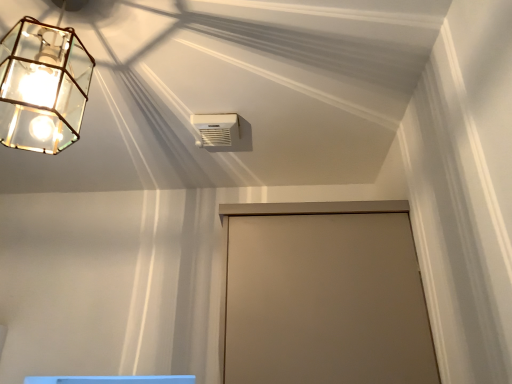
Question: Is white plastic air conditioning unit at upper center bigger or smaller than clear glass lantern at upper left?

Choices:
 (A) small
 (B) big

Answer: (A)

Question: Would you say white plastic air conditioning unit at upper center is to the left or to the right of clear glass lantern at upper left in the picture?

Choices:
 (A) right
 (B) left

Answer: (A)

Question: Considering the real-world distances, which object is closest to the clear glass lantern at upper left?

Choices:
 (A) white plastic air conditioning unit at upper center
 (B) beige matte door at center

Answer: (A)

Question: Which object is the closest to the white plastic air conditioning unit at upper center?

Choices:
 (A) beige matte door at center
 (B) clear glass lantern at upper left

Answer: (B)